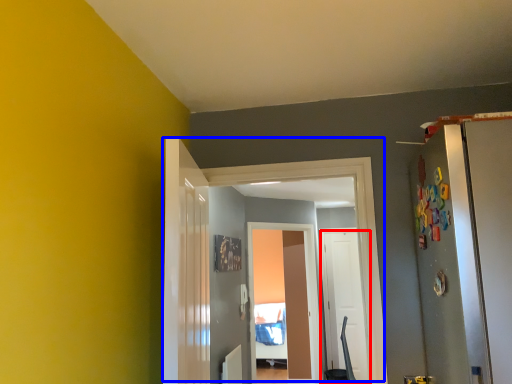
Question: Among these objects, which one is farthest to the camera, door (highlighted by a red box) or door (highlighted by a blue box)?

Choices:
 (A) door
 (B) door

Answer: (A)